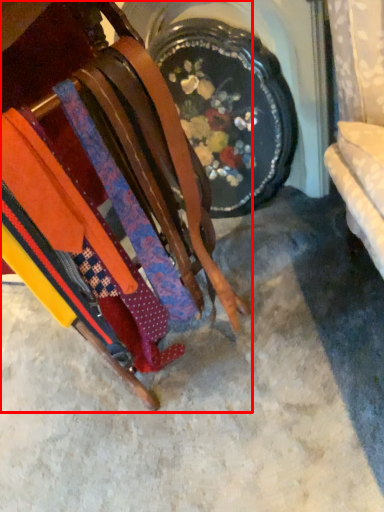
Question: From the image's perspective, considering the relative positions of furniture (annotated by the red box) and concrete in the image provided, where is furniture (annotated by the red box) located with respect to the staircase?

Choices:
 (A) below
 (B) above

Answer: (B)